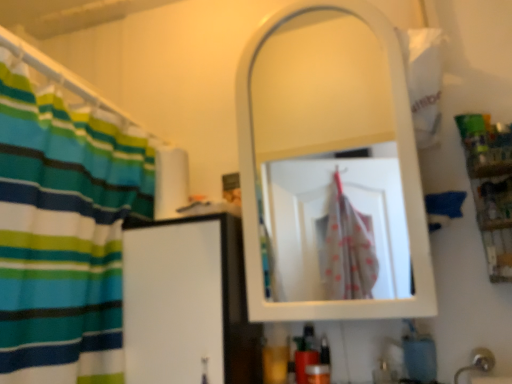
Question: Considering the relative sizes of silver metallic faucet at lower right and blue matte soap at lower right in the image provided, is silver metallic faucet at lower right taller than blue matte soap at lower right?

Choices:
 (A) no
 (B) yes

Answer: (B)

Question: Does silver metallic faucet at lower right appear on the right side of blue matte soap at lower right?

Choices:
 (A) no
 (B) yes

Answer: (B)

Question: From the image's perspective, is silver metallic faucet at lower right beneath blue matte soap at lower right?

Choices:
 (A) no
 (B) yes

Answer: (B)

Question: Is silver metallic faucet at lower right to the left of blue matte soap at lower right from the viewer's perspective?

Choices:
 (A) no
 (B) yes

Answer: (A)

Question: Considering the relative sizes of silver metallic faucet at lower right and blue matte soap at lower right in the image provided, is silver metallic faucet at lower right thinner than blue matte soap at lower right?

Choices:
 (A) no
 (B) yes

Answer: (A)

Question: Is blue matte soap at lower right spatially inside silver metallic faucet at lower right, or outside of it?

Choices:
 (A) inside
 (B) outside

Answer: (B)

Question: Does point (416, 332) appear closer or farther from the camera than point (461, 370)?

Choices:
 (A) closer
 (B) farther

Answer: (B)

Question: Considering the relative positions of blue matte soap at lower right and silver metallic faucet at lower right in the image provided, is blue matte soap at lower right to the left or to the right of silver metallic faucet at lower right?

Choices:
 (A) right
 (B) left

Answer: (B)

Question: From the image's perspective, is blue matte soap at lower right positioned above or below silver metallic faucet at lower right?

Choices:
 (A) below
 (B) above

Answer: (B)

Question: Does point (345, 16) appear closer or farther from the camera than point (430, 347)?

Choices:
 (A) farther
 (B) closer

Answer: (A)

Question: In terms of size, does white glossy mirror at upper center appear bigger or smaller than blue matte soap at lower right?

Choices:
 (A) small
 (B) big

Answer: (B)

Question: From a real-world perspective, relative to blue matte soap at lower right, is white glossy mirror at upper center vertically above or below?

Choices:
 (A) below
 (B) above

Answer: (B)

Question: Do you think white glossy mirror at upper center is within blue matte soap at lower right, or outside of it?

Choices:
 (A) inside
 (B) outside

Answer: (B)

Question: From their relative heights in the image, would you say wooden shelf at right is taller or shorter than white glossy mirror at upper center?

Choices:
 (A) short
 (B) tall

Answer: (A)

Question: Is point (487, 155) closer or farther from the camera than point (258, 66)?

Choices:
 (A) closer
 (B) farther

Answer: (A)